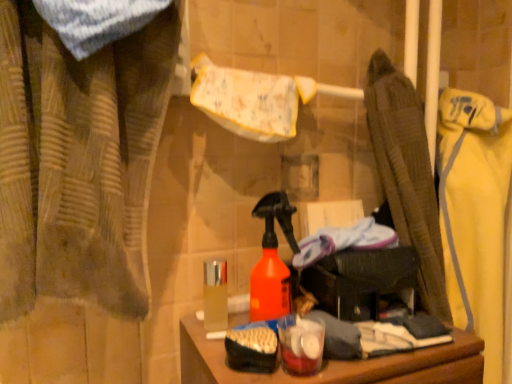
Question: Should I look upward or downward to see brown textured curtain at left?

Choices:
 (A) down
 (B) up

Answer: (B)

Question: From the image's perspective, is brown textured curtain at left beneath yellow fabric jacket at right?

Choices:
 (A) no
 (B) yes

Answer: (A)

Question: Is brown textured curtain at left far from yellow fabric jacket at right?

Choices:
 (A) no
 (B) yes

Answer: (A)

Question: From a real-world perspective, is brown textured curtain at left beneath yellow fabric jacket at right?

Choices:
 (A) no
 (B) yes

Answer: (A)

Question: Is brown textured curtain at left facing away from yellow fabric jacket at right?

Choices:
 (A) no
 (B) yes

Answer: (A)

Question: Is brown textured curtain at left smaller than yellow fabric jacket at right?

Choices:
 (A) no
 (B) yes

Answer: (B)

Question: Considering the relative sizes of brown textured curtain at left and yellow fabric jacket at right in the image provided, is brown textured curtain at left shorter than yellow fabric jacket at right?

Choices:
 (A) no
 (B) yes

Answer: (B)

Question: Is shiny metallic container at center positioned beyond the bounds of white/yellow fabric towel at upper center?

Choices:
 (A) yes
 (B) no

Answer: (A)

Question: Is shiny metallic container at center positioned with its back to white/yellow fabric towel at upper center?

Choices:
 (A) no
 (B) yes

Answer: (A)

Question: Considering the relative positions of shiny metallic container at center and white/yellow fabric towel at upper center in the image provided, is shiny metallic container at center behind white/yellow fabric towel at upper center?

Choices:
 (A) no
 (B) yes

Answer: (B)

Question: Is shiny metallic container at center to the left of white/yellow fabric towel at upper center from the viewer's perspective?

Choices:
 (A) yes
 (B) no

Answer: (A)

Question: From the image's perspective, is shiny metallic container at center below white/yellow fabric towel at upper center?

Choices:
 (A) yes
 (B) no

Answer: (A)

Question: Is shiny metallic container at center facing towards white/yellow fabric towel at upper center?

Choices:
 (A) yes
 (B) no

Answer: (B)

Question: From a real-world perspective, is shiny metallic container at center over brown textured curtain at left?

Choices:
 (A) no
 (B) yes

Answer: (A)